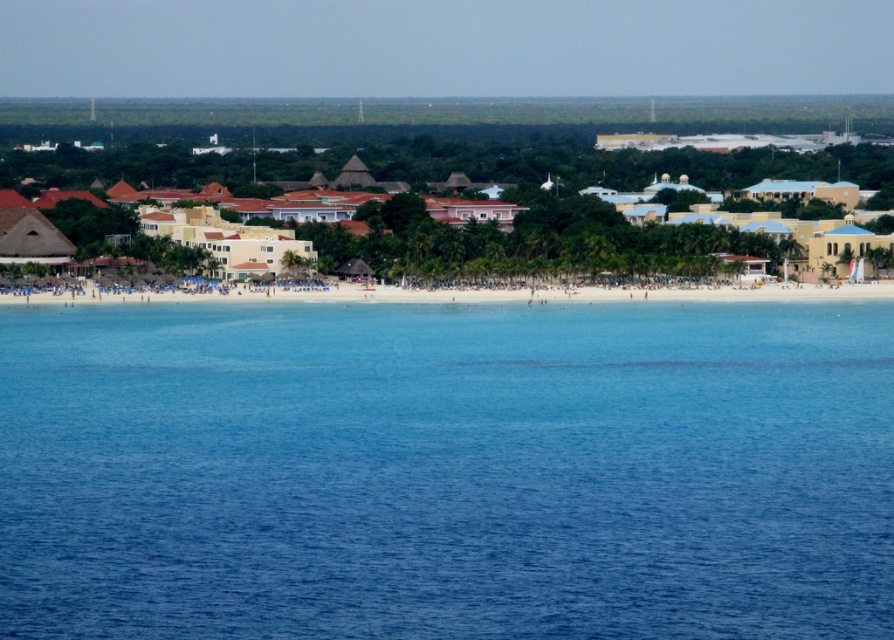
Question: Which is nearer to the white sandy beach at center?

Choices:
 (A) yellow matte building at center
 (B) clear blue water at center

Answer: (A)

Question: Estimate the real-world distances between objects in this image. Which object is farther from the white sandy beach at center?

Choices:
 (A) yellow matte building at center
 (B) clear blue water at center

Answer: (B)

Question: Does yellow matte building at center appear on the left side of white sandy beach at center?

Choices:
 (A) no
 (B) yes

Answer: (B)

Question: Which of the following is the closest to the observer?

Choices:
 (A) (523, 433)
 (B) (183, 300)

Answer: (A)

Question: Is clear blue water at center to the right of yellow matte building at center from the viewer's perspective?

Choices:
 (A) yes
 (B) no

Answer: (A)

Question: From the image, what is the correct spatial relationship of clear blue water at center in relation to yellow matte building at center?

Choices:
 (A) right
 (B) left

Answer: (A)